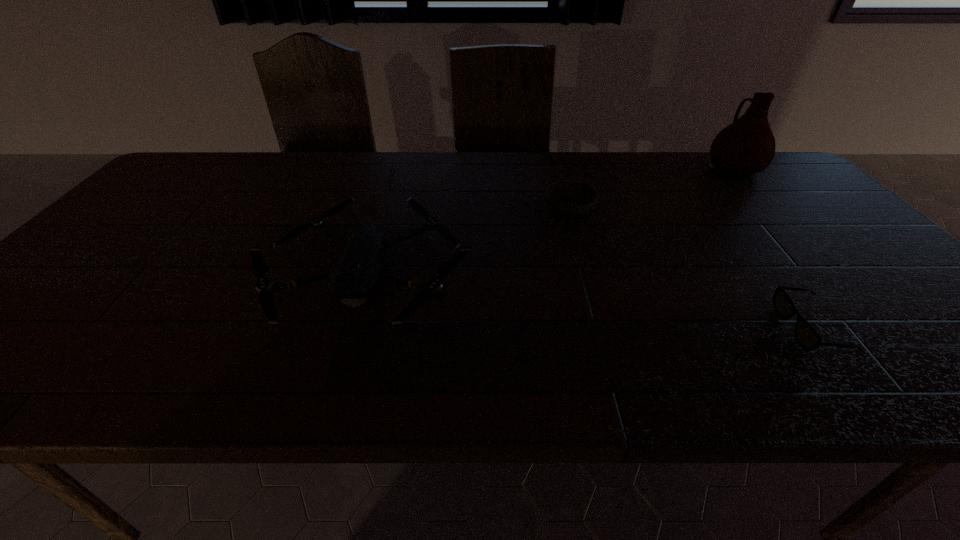
Identify the location of object that can be found as the closest to the third object from right to left. (355, 275).

Point out which object is positioned as the third nearest to the second object from left to right. Please provide its 2D coordinates. Your answer should be formatted as a tuple, i.e. [(x, y)], where the tuple contains the x and y coordinates of a point satisfying the conditions above.

[(807, 337)]